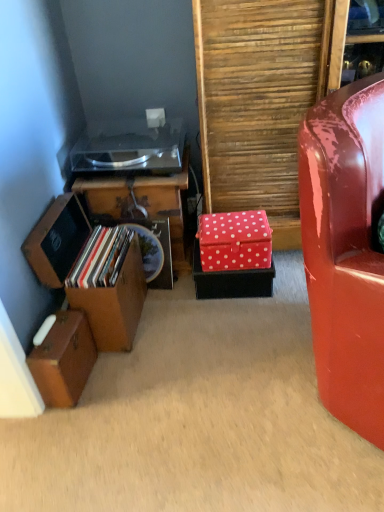
This screenshot has height=512, width=384. I want to click on free location in front of wooden suitcase at lower left, marked as the first storage box in a left-to-right arrangement, so click(x=64, y=431).